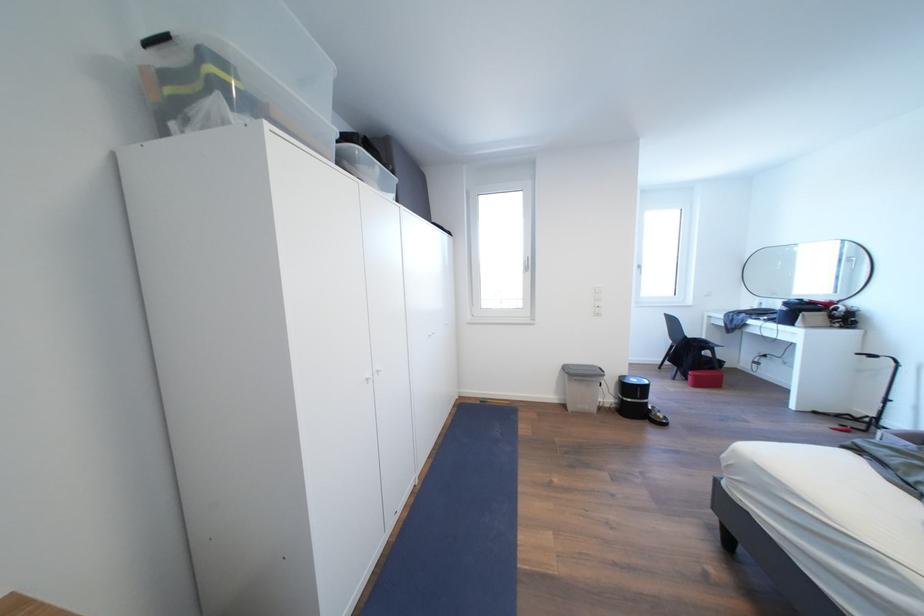
This screenshot has height=616, width=924. In order to click on trash can lid in this screenshot , I will do `click(582, 371)`.